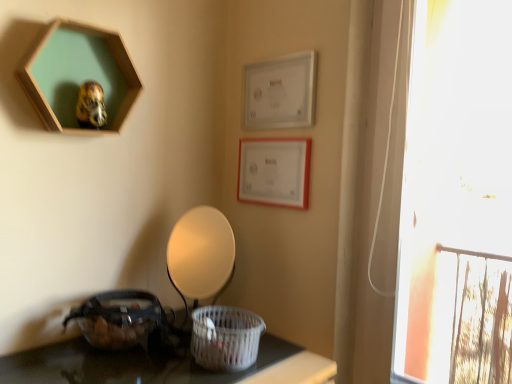
What do you see at coordinates (457, 199) in the screenshot? The height and width of the screenshot is (384, 512). I see `transparent glass window at right` at bounding box center [457, 199].

This screenshot has height=384, width=512. Describe the element at coordinates (225, 338) in the screenshot. I see `white woven basket at lower center, which is counted as the second basket, starting from the left` at that location.

At what (x,y) coordinates should I click in order to perform the action: click on translucent plastic basket at lower left, the first basket from the left. Please return your answer as a coordinate pair (x, y). This screenshot has height=384, width=512. Looking at the image, I should click on (120, 319).

At what (x,y) coordinates should I click in order to perform the action: click on the 1st basket to the left of the transparent glass window at right, starting your count from the anchor. Please return your answer as a coordinate pair (x, y). Looking at the image, I should click on click(225, 338).

Is transparent glass window at right facing towards white woven basket at lower center, which is the first basket in right-to-left order?

No.

Can you confirm if transparent glass window at right is positioned to the right of white woven basket at lower center, which is the first basket in right-to-left order?

Correct, you'll find transparent glass window at right to the right of white woven basket at lower center, which is the first basket in right-to-left order.

How many degrees apart are the facing directions of transparent glass window at right and white woven basket at lower center, which is the first basket in right-to-left order?

There is a 93-degree angle between the facing directions of transparent glass window at right and white woven basket at lower center, which is the first basket in right-to-left order.

From the image's perspective, which object appears higher, matte white lampshade at center or white matte picture frame at upper center, positioned as the third picture frame in left-to-right order?

white matte picture frame at upper center, positioned as the third picture frame in left-to-right order, appears higher in the image.

Is matte white lampshade at center not near white matte picture frame at upper center, which appears as the 1th picture frame when viewed from the right?

They are positioned close to each other.

Could white matte picture frame at upper center, which appears as the 1th picture frame when viewed from the right, be considered to be inside matte white lampshade at center?

No, white matte picture frame at upper center, which appears as the 1th picture frame when viewed from the right, is not inside matte white lampshade at center.

Locate an element on the screen. The image size is (512, 384). table lamp below the white matte picture frame at upper center, which appears as the 1th picture frame when viewed from the right (from a real-world perspective) is located at coordinates pyautogui.click(x=201, y=255).

Is white matte picture frame at upper center, positioned as the third picture frame in left-to-right order, turned away from matte white lampshade at center?

That's not correct — white matte picture frame at upper center, positioned as the third picture frame in left-to-right order, is not looking away from matte white lampshade at center.

Can matte white lampshade at center be found inside white matte picture frame at upper center, positioned as the third picture frame in left-to-right order?

No, matte white lampshade at center is located outside of white matte picture frame at upper center, positioned as the third picture frame in left-to-right order.

Between white matte picture frame at upper center, positioned as the third picture frame in left-to-right order, and matte white lampshade at center, which one appears on the right side from the viewer's perspective?

Positioned to the right is white matte picture frame at upper center, positioned as the third picture frame in left-to-right order.

Is white woven basket at lower center, which is the first basket in right-to-left order, further to the viewer compared to translucent plastic basket at lower left, acting as the second basket starting from the right?

No, white woven basket at lower center, which is the first basket in right-to-left order, is closer to the camera.

Would you say translucent plastic basket at lower left, the first basket from the left, is part of white woven basket at lower center, which is the first basket in right-to-left order,'s contents?

No, translucent plastic basket at lower left, the first basket from the left, is not a part of white woven basket at lower center, which is the first basket in right-to-left order.

From the image's perspective, which object appears higher, white woven basket at lower center, which is the first basket in right-to-left order, or translucent plastic basket at lower left, acting as the second basket starting from the right?

translucent plastic basket at lower left, acting as the second basket starting from the right.

Would you say wooden hexagon at upper left, which is counted as the 3th picture frame, starting from the right, contains matte white picture frame at upper right, which is the 2th picture frame in right-to-left order?

No, matte white picture frame at upper right, which is the 2th picture frame in right-to-left order, is not inside wooden hexagon at upper left, which is counted as the 3th picture frame, starting from the right.

How different are the orientations of wooden hexagon at upper left, the 1th picture frame from the left, and matte white picture frame at upper right, which is the 2th picture frame in right-to-left order, in degrees?

The angular difference between wooden hexagon at upper left, the 1th picture frame from the left, and matte white picture frame at upper right, which is the 2th picture frame in right-to-left order, is 89.5 degrees.

From their relative heights in the image, would you say wooden hexagon at upper left, the 1th picture frame from the left, is taller or shorter than matte white picture frame at upper right, which is the 2th picture frame in right-to-left order?

wooden hexagon at upper left, the 1th picture frame from the left, is taller than matte white picture frame at upper right, which is the 2th picture frame in right-to-left order.

Are wooden hexagon at upper left, which is counted as the 3th picture frame, starting from the right, and matte white picture frame at upper right, acting as the 2th picture frame starting from the left, located far from each other?

They are positioned close to each other.

From the transparent glass window at right, count 1st picture frames backward and point to it. Please provide its 2D coordinates.

[(80, 78)]

Are wooden hexagon at upper left, the 1th picture frame from the left, and transparent glass window at right far apart?

wooden hexagon at upper left, the 1th picture frame from the left, is positioned a significant distance from transparent glass window at right.

In the scene shown: Who is smaller, wooden hexagon at upper left, which is counted as the 3th picture frame, starting from the right, or transparent glass window at right?

With smaller size is wooden hexagon at upper left, which is counted as the 3th picture frame, starting from the right.

Looking at this image, would you say matte white lampshade at center contains translucent plastic basket at lower left, acting as the second basket starting from the right?

No, translucent plastic basket at lower left, acting as the second basket starting from the right, is not inside matte white lampshade at center.

Is matte white lampshade at center further to camera compared to translucent plastic basket at lower left, the first basket from the left?

Yes, it is behind translucent plastic basket at lower left, the first basket from the left.

Measure the distance between matte white lampshade at center and translucent plastic basket at lower left, acting as the second basket starting from the right.

matte white lampshade at center and translucent plastic basket at lower left, acting as the second basket starting from the right, are 7.59 inches apart from each other.

Between matte white lampshade at center and translucent plastic basket at lower left, the first basket from the left, which one appears on the right side from the viewer's perspective?

matte white lampshade at center.

Where is `window above the white woven basket at lower center, which is counted as the second basket, starting from the left (from a real-world perspective)`? The height and width of the screenshot is (384, 512). window above the white woven basket at lower center, which is counted as the second basket, starting from the left (from a real-world perspective) is located at coordinates (457, 199).

There is a matte white lampshade at center. Where is `the 3rd picture frame above it (from the image's perspective)`? The image size is (512, 384). the 3rd picture frame above it (from the image's perspective) is located at coordinates (280, 92).

Looking at the image, which one is located closer to wooden hexagon at upper left, which is counted as the 3th picture frame, starting from the right, white woven basket at lower center, which is the first basket in right-to-left order, or matte white picture frame at upper right, acting as the 2th picture frame starting from the left?

Based on the image, matte white picture frame at upper right, acting as the 2th picture frame starting from the left, appears to be nearer to wooden hexagon at upper left, which is counted as the 3th picture frame, starting from the right.

From the image, which object appears to be nearer to white matte picture frame at upper center, which appears as the 1th picture frame when viewed from the right, matte white lampshade at center or wooden hexagon at upper left, which is counted as the 3th picture frame, starting from the right?

The object closer to white matte picture frame at upper center, which appears as the 1th picture frame when viewed from the right, is matte white lampshade at center.

Based on their spatial positions, is wooden hexagon at upper left, which is counted as the 3th picture frame, starting from the right, or matte white lampshade at center further from translucent plastic basket at lower left, the first basket from the left?

Based on the image, wooden hexagon at upper left, which is counted as the 3th picture frame, starting from the right, appears to be further to translucent plastic basket at lower left, the first basket from the left.

From the image, which object appears to be farther from matte white lampshade at center, white matte picture frame at upper center, positioned as the third picture frame in left-to-right order, or transparent glass window at right?

The object further to matte white lampshade at center is transparent glass window at right.

From the picture: Looking at the image, which one is located closer to translucent plastic basket at lower left, acting as the second basket starting from the right, white matte picture frame at upper center, positioned as the third picture frame in left-to-right order, or wooden hexagon at upper left, the 1th picture frame from the left?

Based on the image, wooden hexagon at upper left, the 1th picture frame from the left, appears to be nearer to translucent plastic basket at lower left, acting as the second basket starting from the right.

Estimate the real-world distances between objects in this image. Which object is closer to translucent plastic basket at lower left, acting as the second basket starting from the right, wooden hexagon at upper left, the 1th picture frame from the left, or transparent glass window at right?

wooden hexagon at upper left, the 1th picture frame from the left, is positioned closer to the anchor translucent plastic basket at lower left, acting as the second basket starting from the right.

When comparing their distances from wooden hexagon at upper left, which is counted as the 3th picture frame, starting from the right, does white matte picture frame at upper center, positioned as the third picture frame in left-to-right order, or matte white lampshade at center seem further?

white matte picture frame at upper center, positioned as the third picture frame in left-to-right order, lies further to wooden hexagon at upper left, which is counted as the 3th picture frame, starting from the right, than the other object.

Estimate the real-world distances between objects in this image. Which object is closer to white matte picture frame at upper center, which appears as the 1th picture frame when viewed from the right, translucent plastic basket at lower left, the first basket from the left, or white woven basket at lower center, which is the first basket in right-to-left order?

white woven basket at lower center, which is the first basket in right-to-left order, lies closer to white matte picture frame at upper center, which appears as the 1th picture frame when viewed from the right, than the other object.

What are the coordinates of `table lamp between white matte picture frame at upper center, positioned as the third picture frame in left-to-right order, and white woven basket at lower center, which is counted as the second basket, starting from the left, vertically` in the screenshot? It's located at (201, 255).

This screenshot has width=512, height=384. I want to click on table lamp that lies between white matte picture frame at upper center, positioned as the third picture frame in left-to-right order, and translucent plastic basket at lower left, acting as the second basket starting from the right, from top to bottom, so click(x=201, y=255).

This screenshot has height=384, width=512. I want to click on basket between matte white picture frame at upper right, acting as the 2th picture frame starting from the left, and white woven basket at lower center, which is the first basket in right-to-left order, in the up-down direction, so click(x=120, y=319).

Where is `table lamp between matte white picture frame at upper right, acting as the 2th picture frame starting from the left, and white woven basket at lower center, which is counted as the second basket, starting from the left, vertically`? table lamp between matte white picture frame at upper right, acting as the 2th picture frame starting from the left, and white woven basket at lower center, which is counted as the second basket, starting from the left, vertically is located at coordinates (201, 255).